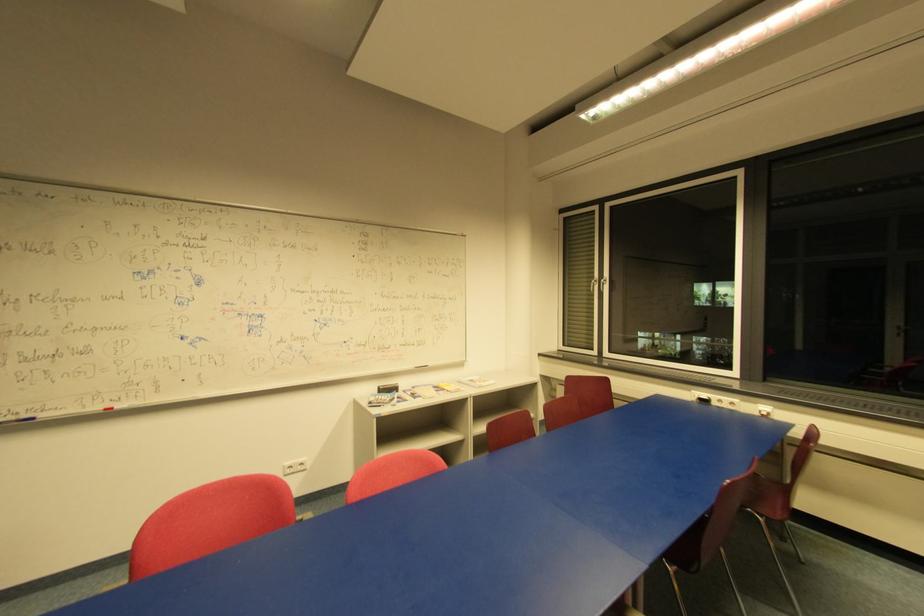
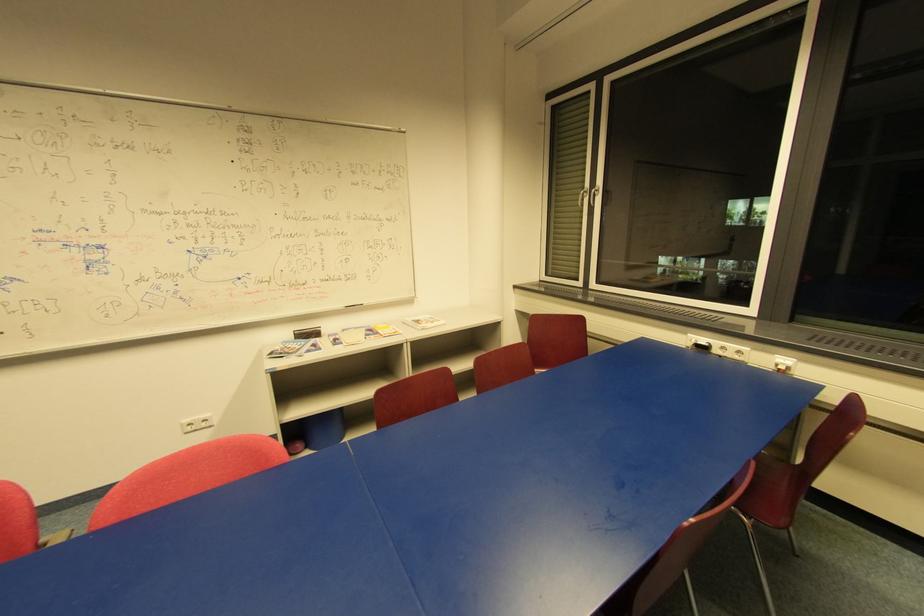
Locate, in the second image, the point that corresponds to the point at 416,368 in the first image.

(344, 307)